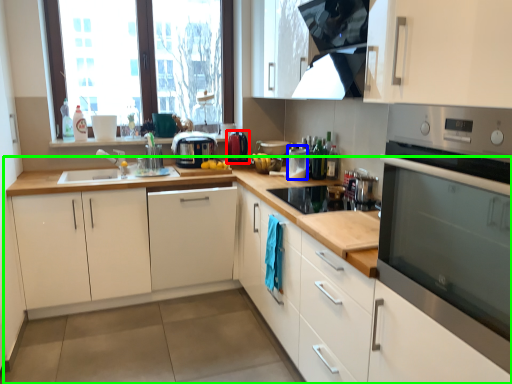
Question: Which object is the farthest from kitchen appliance (highlighted by a red box)? Choose among these: appliance (highlighted by a blue box) or countertop (highlighted by a green box).

Choices:
 (A) appliance
 (B) countertop

Answer: (B)